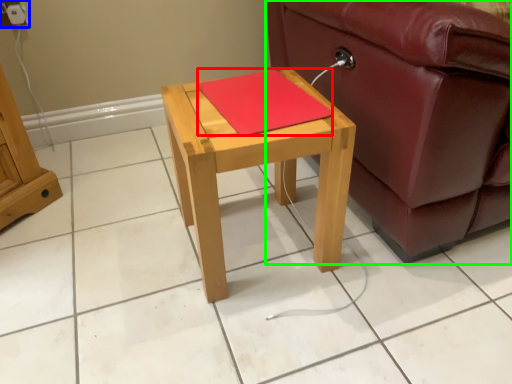
Question: Based on their relative distances, which object is farther from pad (highlighted by a red box)? Choose from electric outlet (highlighted by a blue box) and studio couch (highlighted by a green box).

Choices:
 (A) electric outlet
 (B) studio couch

Answer: (A)